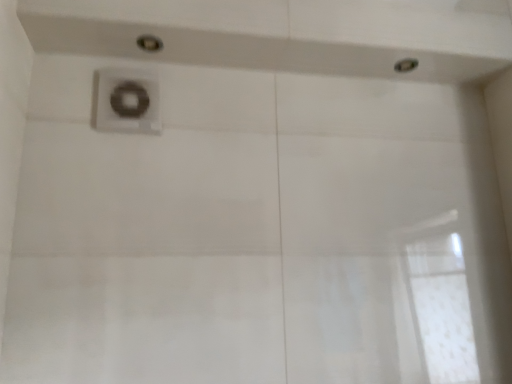
Find the location of a particular element. The image size is (512, 384). satin nickel faucet at upper center is located at coordinates (125, 102).

Which object is closer to the camera taking this photo, metallic silver showerhead at upper right, the first shower in the back-to-front sequence, or matte silver shower at upper center, placed as the 1th shower when sorted from front to back?

matte silver shower at upper center, placed as the 1th shower when sorted from front to back.

Locate an element on the screen. This screenshot has height=384, width=512. shower above the metallic silver showerhead at upper right, the first shower in the back-to-front sequence (from the image's perspective) is located at coordinates (149, 43).

Looking at their sizes, would you say metallic silver showerhead at upper right, the first shower in the back-to-front sequence, is wider or thinner than matte silver shower at upper center, which ranks as the second shower in right-to-left order?

In the image, metallic silver showerhead at upper right, the first shower in the back-to-front sequence, appears to be wider than matte silver shower at upper center, which ranks as the second shower in right-to-left order.

From the image's perspective, is metallic silver showerhead at upper right, which is the 2th shower from front to back, located above matte silver shower at upper center, positioned as the 2th shower in back-to-front order?

Actually, metallic silver showerhead at upper right, which is the 2th shower from front to back, appears below matte silver shower at upper center, positioned as the 2th shower in back-to-front order, in the image.

Which object is further away from the camera taking this photo, metallic silver showerhead at upper right, arranged as the second shower when viewed from the left, or satin nickel faucet at upper center?

metallic silver showerhead at upper right, arranged as the second shower when viewed from the left, is more distant.

From the image's perspective, between metallic silver showerhead at upper right, the first shower in the back-to-front sequence, and satin nickel faucet at upper center, which one is located above?

metallic silver showerhead at upper right, the first shower in the back-to-front sequence, appears higher in the image.

How many degrees apart are the facing directions of metallic silver showerhead at upper right, arranged as the second shower when viewed from the left, and satin nickel faucet at upper center?

They differ by 90.2 degrees in their facing directions.

Is point (156, 47) positioned behind point (104, 108)?

Yes.

Is the surface of matte silver shower at upper center, the first shower from the left, in direct contact with satin nickel faucet at upper center?

No, matte silver shower at upper center, the first shower from the left, is not touching satin nickel faucet at upper center.

From the image's perspective, is matte silver shower at upper center, the first shower from the left, under satin nickel faucet at upper center?

No, from the image's perspective, matte silver shower at upper center, the first shower from the left, is not below satin nickel faucet at upper center.

Considering the relative sizes of matte silver shower at upper center, placed as the 1th shower when sorted from front to back, and satin nickel faucet at upper center in the image provided, is matte silver shower at upper center, placed as the 1th shower when sorted from front to back, taller than satin nickel faucet at upper center?

In fact, matte silver shower at upper center, placed as the 1th shower when sorted from front to back, may be shorter than satin nickel faucet at upper center.

Is matte silver shower at upper center, placed as the 1th shower when sorted from front to back, not within metallic silver showerhead at upper right, which is the 2th shower from front to back?

Yes, matte silver shower at upper center, placed as the 1th shower when sorted from front to back, is not within metallic silver showerhead at upper right, which is the 2th shower from front to back.

Looking at this image, from the image's perspective, does matte silver shower at upper center, which ranks as the second shower in right-to-left order, appear lower than metallic silver showerhead at upper right, arranged as the second shower when viewed from the left?

Incorrect, from the image's perspective, matte silver shower at upper center, which ranks as the second shower in right-to-left order, is higher than metallic silver showerhead at upper right, arranged as the second shower when viewed from the left.

Between matte silver shower at upper center, positioned as the 2th shower in back-to-front order, and metallic silver showerhead at upper right, arranged as the second shower when viewed from the left, which one has less height?

metallic silver showerhead at upper right, arranged as the second shower when viewed from the left, is shorter.

Is matte silver shower at upper center, placed as the 1th shower when sorted from front to back, bigger than metallic silver showerhead at upper right, which is the 1th shower in right-to-left order?

Yes, matte silver shower at upper center, placed as the 1th shower when sorted from front to back, is bigger than metallic silver showerhead at upper right, which is the 1th shower in right-to-left order.

From the image's perspective, would you say satin nickel faucet at upper center is shown under metallic silver showerhead at upper right, which is the 2th shower from front to back?

Yes, from the image's perspective, satin nickel faucet at upper center is below metallic silver showerhead at upper right, which is the 2th shower from front to back.

Is satin nickel faucet at upper center with metallic silver showerhead at upper right, the first shower in the back-to-front sequence?

They are not placed beside each other.

From the picture: Can you confirm if satin nickel faucet at upper center is taller than metallic silver showerhead at upper right, which is the 1th shower in right-to-left order?

Yes.

From the picture: Considering the positions of objects satin nickel faucet at upper center and metallic silver showerhead at upper right, which is the 1th shower in right-to-left order, in the image provided, who is more to the right, satin nickel faucet at upper center or metallic silver showerhead at upper right, which is the 1th shower in right-to-left order,?

metallic silver showerhead at upper right, which is the 1th shower in right-to-left order.

Between satin nickel faucet at upper center and matte silver shower at upper center, placed as the 1th shower when sorted from front to back, which one has more height?

Standing taller between the two is satin nickel faucet at upper center.

Looking at this image, from a real-world perspective, is satin nickel faucet at upper center on matte silver shower at upper center, which ranks as the second shower in right-to-left order?

No.

Consider the image. From the image's perspective, which is below, satin nickel faucet at upper center or matte silver shower at upper center, the first shower from the left?

From the image's view, satin nickel faucet at upper center is below.

In the scene shown: Is satin nickel faucet at upper center closer to the viewer compared to matte silver shower at upper center, positioned as the 2th shower in back-to-front order?

No, the depth of satin nickel faucet at upper center is greater than that of matte silver shower at upper center, positioned as the 2th shower in back-to-front order.

You are a GUI agent. You are given a task and a screenshot of the screen. Output one action in this format:
    pyautogui.click(x=<x>, y=<y>)
    Task: Click on the shower above the metallic silver showerhead at upper right, which is the 2th shower from front to back (from the image's perspective)
    This screenshot has width=512, height=384.
    Given the screenshot: What is the action you would take?
    pyautogui.click(x=149, y=43)

You are a GUI agent. You are given a task and a screenshot of the screen. Output one action in this format:
    pyautogui.click(x=<x>, y=<y>)
    Task: Click on the 2nd shower positioned above the satin nickel faucet at upper center (from a real-world perspective)
    
    Given the screenshot: What is the action you would take?
    pyautogui.click(x=406, y=65)

From the image, which object appears to be nearer to matte silver shower at upper center, positioned as the 2th shower in back-to-front order, metallic silver showerhead at upper right, which is the 1th shower in right-to-left order, or satin nickel faucet at upper center?

satin nickel faucet at upper center lies closer to matte silver shower at upper center, positioned as the 2th shower in back-to-front order, than the other object.

Based on their spatial positions, is metallic silver showerhead at upper right, which is the 1th shower in right-to-left order, or matte silver shower at upper center, placed as the 1th shower when sorted from front to back, further from satin nickel faucet at upper center?

metallic silver showerhead at upper right, which is the 1th shower in right-to-left order, lies further to satin nickel faucet at upper center than the other object.

Looking at the image, which one is located closer to metallic silver showerhead at upper right, arranged as the second shower when viewed from the left, satin nickel faucet at upper center or matte silver shower at upper center, positioned as the 2th shower in back-to-front order?

matte silver shower at upper center, positioned as the 2th shower in back-to-front order.

Based on their spatial positions, is satin nickel faucet at upper center or metallic silver showerhead at upper right, the first shower in the back-to-front sequence, further from matte silver shower at upper center, the first shower from the left?

metallic silver showerhead at upper right, the first shower in the back-to-front sequence, is positioned further to the anchor matte silver shower at upper center, the first shower from the left.

From the image, which object appears to be farther from satin nickel faucet at upper center, matte silver shower at upper center, the first shower from the left, or metallic silver showerhead at upper right, which is the 1th shower in right-to-left order?

The object further to satin nickel faucet at upper center is metallic silver showerhead at upper right, which is the 1th shower in right-to-left order.

Estimate the real-world distances between objects in this image. Which object is closer to metallic silver showerhead at upper right, which is the 2th shower from front to back, matte silver shower at upper center, the first shower from the left, or satin nickel faucet at upper center?

matte silver shower at upper center, the first shower from the left, is positioned closer to the anchor metallic silver showerhead at upper right, which is the 2th shower from front to back.

Locate an element on the screen. The image size is (512, 384). shower between satin nickel faucet at upper center and metallic silver showerhead at upper right, arranged as the second shower when viewed from the left is located at coordinates (149, 43).